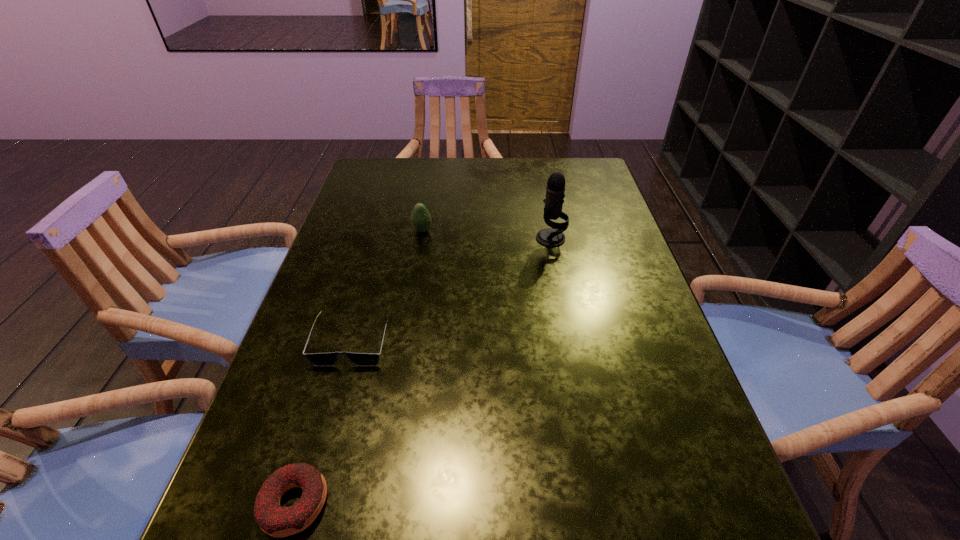
At what (x,y) coordinates should I click in order to perform the action: click on the tallest object. Please return your answer as a coordinate pair (x, y). Looking at the image, I should click on (551, 237).

The height and width of the screenshot is (540, 960). Find the location of `microphone`. microphone is located at coordinates (551, 237).

Locate an element on the screen. the second object from right to left is located at coordinates (421, 221).

The width and height of the screenshot is (960, 540). I want to click on avocado, so click(x=421, y=221).

You are a GUI agent. You are given a task and a screenshot of the screen. Output one action in this format:
    pyautogui.click(x=<x>, y=<y>)
    Task: Click on the sunglasses
    The height and width of the screenshot is (540, 960).
    Given the screenshot: What is the action you would take?
    pyautogui.click(x=318, y=359)

At what (x,y) coordinates should I click in order to perform the action: click on vacant space located 0.270m on the left of the rightmost object. Please return your answer as a coordinate pair (x, y). The height and width of the screenshot is (540, 960). Looking at the image, I should click on (434, 238).

Find the location of a particular element. This screenshot has width=960, height=540. free space located on the right of the second object from right to left is located at coordinates (540, 231).

This screenshot has height=540, width=960. I want to click on free space located on the front-facing side of the third farthest object, so click(x=334, y=408).

Identify the location of object at the left edge. The height and width of the screenshot is (540, 960). [318, 359].

The height and width of the screenshot is (540, 960). In the image, there is a desktop. Find the location of `vacant space at the far edge`. vacant space at the far edge is located at coordinates (458, 170).